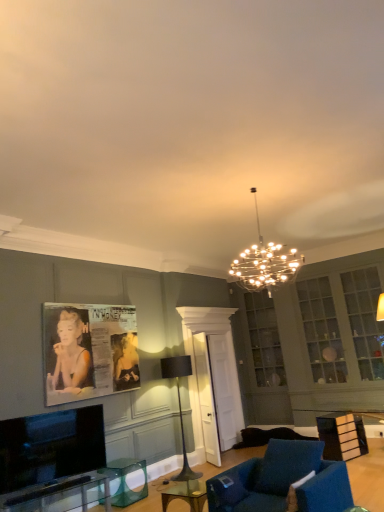
Question: Is metallic chandelier at center, placed as the 1th lamp when sorted from right to left, looking in the opposite direction of transparent glass table at lower center, which ranks as the 2th round table in top-to-bottom order?

Choices:
 (A) no
 (B) yes

Answer: (A)

Question: Can you confirm if metallic chandelier at center, the 2th lamp positioned from the back, is thinner than transparent glass table at lower center, which ranks as the first round table in back-to-front order?

Choices:
 (A) yes
 (B) no

Answer: (B)

Question: Is transparent glass table at lower center, which ranks as the first round table in back-to-front order, inside metallic chandelier at center, positioned as the 1th lamp in top-to-bottom order?

Choices:
 (A) no
 (B) yes

Answer: (A)

Question: Is metallic chandelier at center, the 2th lamp positioned from the back, completely or partially outside of transparent glass table at lower center, the first round table in the bottom-to-top sequence?

Choices:
 (A) yes
 (B) no

Answer: (A)

Question: Is the surface of metallic chandelier at center, which is counted as the second lamp, starting from the left, in direct contact with transparent glass table at lower center, the 2th round table in the right-to-left sequence?

Choices:
 (A) yes
 (B) no

Answer: (B)

Question: Is clear glass table at center, the second round table when ordered from back to front, in front of or behind black metal floor lamp at center, marked as the 1th lamp in a left-to-right arrangement, in the image?

Choices:
 (A) front
 (B) behind

Answer: (A)

Question: Considering the positions of clear glass table at center, which is the first round table in top-to-bottom order, and black metal floor lamp at center, the first lamp when ordered from bottom to top, in the image, is clear glass table at center, which is the first round table in top-to-bottom order, bigger or smaller than black metal floor lamp at center, the first lamp when ordered from bottom to top,?

Choices:
 (A) big
 (B) small

Answer: (B)

Question: In the image, is clear glass table at center, positioned as the 1th round table in front-to-back order, on the left side or the right side of black metal floor lamp at center, marked as the 1th lamp in a left-to-right arrangement?

Choices:
 (A) right
 (B) left

Answer: (A)

Question: Do you think clear glass table at center, which is the first round table in top-to-bottom order, is within black metal floor lamp at center, the 1th lamp positioned from the back, or outside of it?

Choices:
 (A) inside
 (B) outside

Answer: (B)

Question: Which is correct: transparent glass table at lower center, positioned as the second round table in front-to-back order, is inside flat screen tv at lower left, or outside of it?

Choices:
 (A) inside
 (B) outside

Answer: (B)

Question: Is transparent glass table at lower center, the 2th round table in the right-to-left sequence, wider or thinner than flat screen tv at lower left?

Choices:
 (A) thin
 (B) wide

Answer: (B)

Question: From a real-world perspective, relative to flat screen tv at lower left, is transparent glass table at lower center, the 2th round table in the right-to-left sequence, vertically above or below?

Choices:
 (A) above
 (B) below

Answer: (B)

Question: From their relative heights in the image, would you say transparent glass table at lower center, the 2th round table in the right-to-left sequence, is taller or shorter than flat screen tv at lower left?

Choices:
 (A) short
 (B) tall

Answer: (A)

Question: From a real-world perspective, relative to clear glass table at center, acting as the 2th round table starting from the bottom, is clear glass table at lower left, the 2th table positioned from the right, vertically above or below?

Choices:
 (A) above
 (B) below

Answer: (A)

Question: In the image, is clear glass table at lower left, the second table from the back, on the left side or the right side of clear glass table at center, positioned as the 1th round table in front-to-back order?

Choices:
 (A) left
 (B) right

Answer: (A)